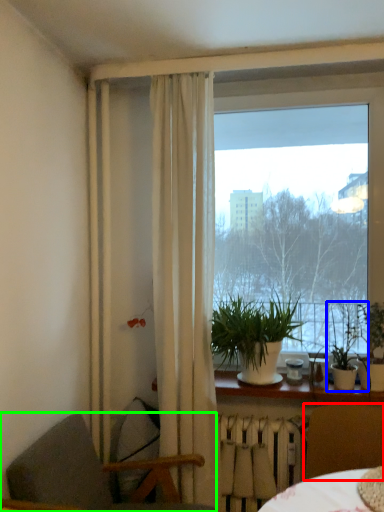
Question: Estimate the real-world distances between objects in this image. Which object is farther from chair (highlighted by a red box), houseplant (highlighted by a blue box) or chair (highlighted by a green box)?

Choices:
 (A) houseplant
 (B) chair

Answer: (B)